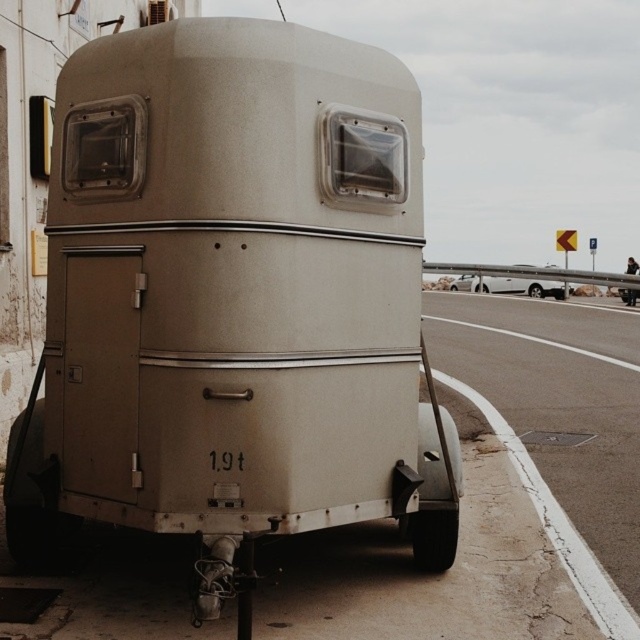
Is asphalt road at lower right behind matte white trailer at center?

No, it is not.

Identify the location of asphalt road at lower right. The image size is (640, 640). (560, 424).

Does matte beige trailer truck at center have a greater width compared to matte white trailer at center?

Incorrect, matte beige trailer truck at center's width does not surpass matte white trailer at center's.

Who is lower down, matte beige trailer truck at center or matte white trailer at center?

matte beige trailer truck at center is below.

Does point (321, 401) come in front of point (552, 291)?

Yes, it is.

Where is `matte beige trailer truck at center`? The width and height of the screenshot is (640, 640). matte beige trailer truck at center is located at coordinates (x=232, y=300).

This screenshot has width=640, height=640. What do you see at coordinates (232, 300) in the screenshot?
I see `matte beige trailer truck at center` at bounding box center [232, 300].

Is matte beige trailer truck at center behind asphalt road at lower right?

No, it is not.

Which is in front, point (337, 67) or point (426, 326)?

Positioned in front is point (337, 67).

The image size is (640, 640). What are the coordinates of `matte beige trailer truck at center` in the screenshot? It's located at (232, 300).